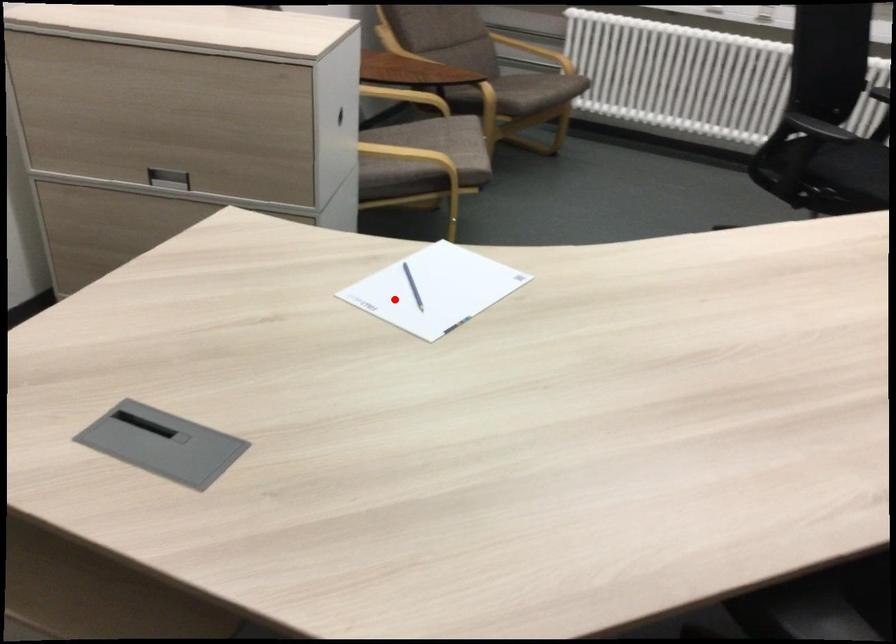
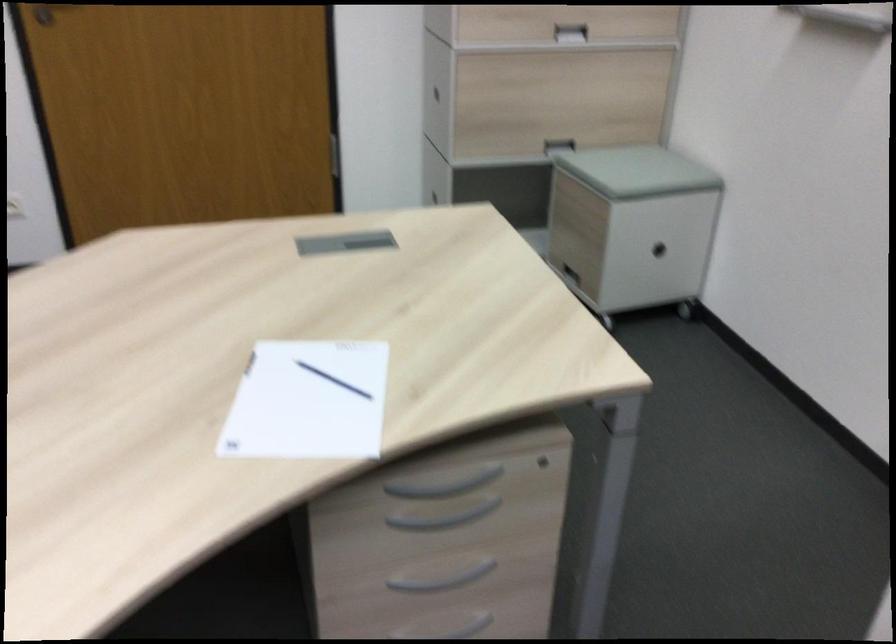
Find the pixel in the second image that matches the highlighted location in the first image.

(333, 380)